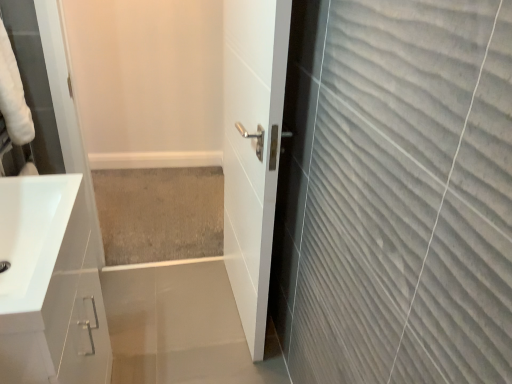
Question: Is white glossy door at center positioned in front of white glossy sink at lower left?

Choices:
 (A) yes
 (B) no

Answer: (B)

Question: From a real-world perspective, is white glossy door at center positioned under white glossy sink at lower left based on gravity?

Choices:
 (A) yes
 (B) no

Answer: (A)

Question: Does white glossy door at center appear on the right side of white glossy sink at lower left?

Choices:
 (A) yes
 (B) no

Answer: (A)

Question: Is white glossy door at center facing towards white glossy sink at lower left?

Choices:
 (A) no
 (B) yes

Answer: (B)

Question: Does white glossy door at center have a greater width compared to white glossy sink at lower left?

Choices:
 (A) yes
 (B) no

Answer: (B)

Question: Relative to white glossy door at center, is beige carpet at center in front or behind?

Choices:
 (A) front
 (B) behind

Answer: (B)

Question: Considering the positions of beige carpet at center and white glossy door at center in the image, is beige carpet at center wider or thinner than white glossy door at center?

Choices:
 (A) thin
 (B) wide

Answer: (B)

Question: Does point (101, 226) appear closer or farther from the camera than point (258, 18)?

Choices:
 (A) farther
 (B) closer

Answer: (A)

Question: Considering the positions of beige carpet at center and white glossy door at center in the image, is beige carpet at center bigger or smaller than white glossy door at center?

Choices:
 (A) big
 (B) small

Answer: (B)

Question: Considering the positions of white glossy door at center and white glossy sink at lower left in the image, is white glossy door at center wider or thinner than white glossy sink at lower left?

Choices:
 (A) wide
 (B) thin

Answer: (B)

Question: Is white glossy door at center spatially inside white glossy sink at lower left, or outside of it?

Choices:
 (A) outside
 (B) inside

Answer: (A)

Question: From the image's perspective, is white glossy door at center located above or below white glossy sink at lower left?

Choices:
 (A) above
 (B) below

Answer: (A)

Question: In the image, is white glossy door at center positioned in front of or behind white glossy sink at lower left?

Choices:
 (A) behind
 (B) front

Answer: (A)

Question: From a real-world perspective, relative to beige carpet at center, is white glossy door at center vertically above or below?

Choices:
 (A) above
 (B) below

Answer: (A)

Question: From the image's perspective, is white glossy door at center above or below beige carpet at center?

Choices:
 (A) above
 (B) below

Answer: (A)